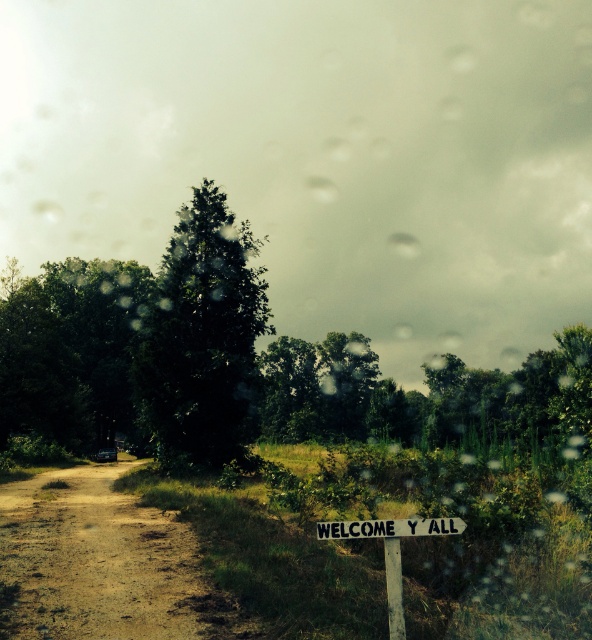
Question: Does green leafy tree at upper left have a smaller size compared to white wooden sign at lower center?

Choices:
 (A) yes
 (B) no

Answer: (B)

Question: Which of the following is the closest to the observer?

Choices:
 (A) (377, 531)
 (B) (217, 388)
 (C) (102, 456)
 (D) (118, 305)

Answer: (A)

Question: Can you confirm if brown dirt track at lower left is positioned to the right of white wooden sign at lower center?

Choices:
 (A) yes
 (B) no

Answer: (B)

Question: Which object is positioned farthest from the green leafy tree at center?

Choices:
 (A) white wooden sign at lower center
 (B) brown dirt track at lower left
 (C) transparent glass car window at center

Answer: (C)

Question: Which point is farther from the camera taking this photo?

Choices:
 (A) (121, 637)
 (B) (182, 432)
 (C) (88, 394)
 (D) (361, 520)

Answer: (C)

Question: In this image, where is green leafy tree at center located relative to green leafy tree at upper left?

Choices:
 (A) left
 (B) right

Answer: (B)